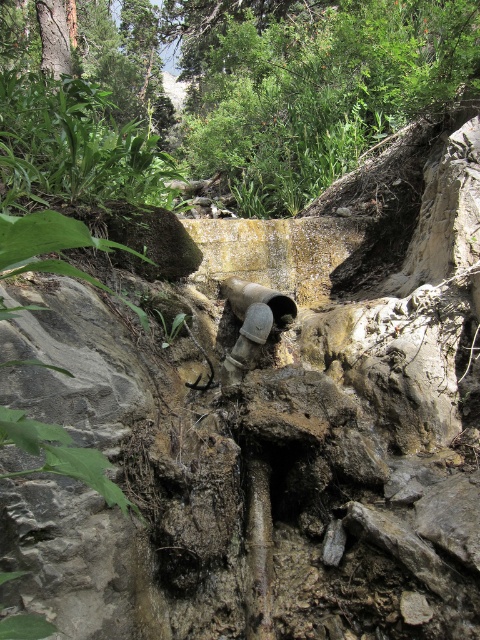
Which is above, green leafy tree at upper center or matte gray water pipe at center?

green leafy tree at upper center is above.

Which of these two, green leafy tree at upper center or matte gray water pipe at center, stands shorter?

With less height is green leafy tree at upper center.

What do you see at coordinates (226, 93) in the screenshot? This screenshot has width=480, height=640. I see `green leafy tree at upper center` at bounding box center [226, 93].

This screenshot has width=480, height=640. Find the location of `green leafy tree at upper center`. green leafy tree at upper center is located at coordinates (226, 93).